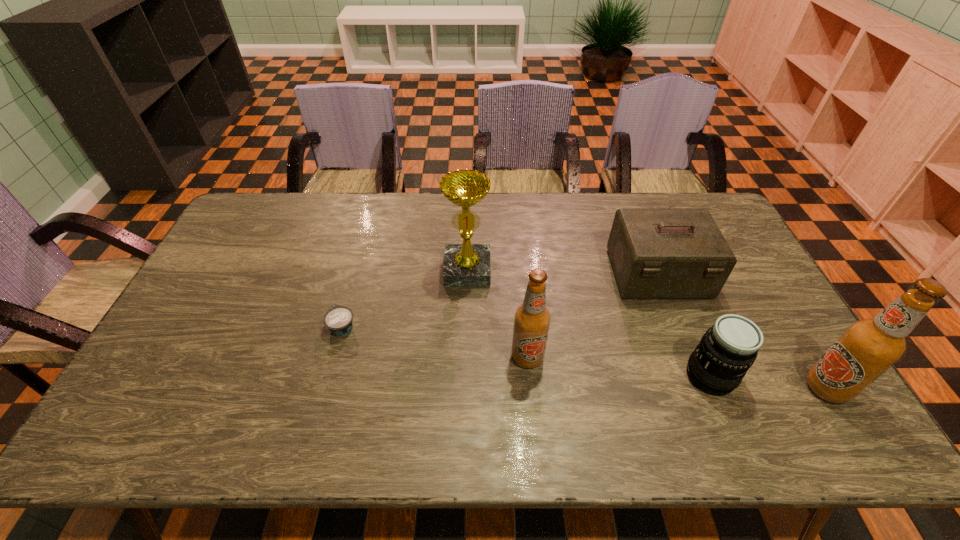
Locate an element on the screen. free spot located 0.380m on the front label of the right beer bottle is located at coordinates (652, 388).

Image resolution: width=960 pixels, height=540 pixels. I want to click on vacant space located on the front label of the right beer bottle, so click(684, 388).

Image resolution: width=960 pixels, height=540 pixels. Find the location of `free space located 0.250m on the front label of the right beer bottle`. free space located 0.250m on the front label of the right beer bottle is located at coordinates (x=705, y=388).

You are a GUI agent. You are given a task and a screenshot of the screen. Output one action in this format:
    pyautogui.click(x=<x>, y=<y>)
    Task: Click on the free location located 0.080m on the back of the first-aid kit
    The image size is (960, 540).
    Given the screenshot: What is the action you would take?
    pyautogui.click(x=641, y=232)

Locate an element on the screen. vacant region located 0.320m on the front-facing side of the award is located at coordinates (465, 379).

Where is `blank space located on the right of the yogurt`? This screenshot has width=960, height=540. blank space located on the right of the yogurt is located at coordinates (418, 327).

The height and width of the screenshot is (540, 960). I want to click on vacant point located on the left of the telephoto lens, so pyautogui.click(x=595, y=376).

What are the coordinates of `beer bottle that is positioned at the near edge` in the screenshot? It's located at (868, 347).

Locate an element on the screen. The height and width of the screenshot is (540, 960). telephoto lens situated at the near edge is located at coordinates (727, 350).

Find the location of a particular element. The width and height of the screenshot is (960, 540). object located at the right edge is located at coordinates (868, 347).